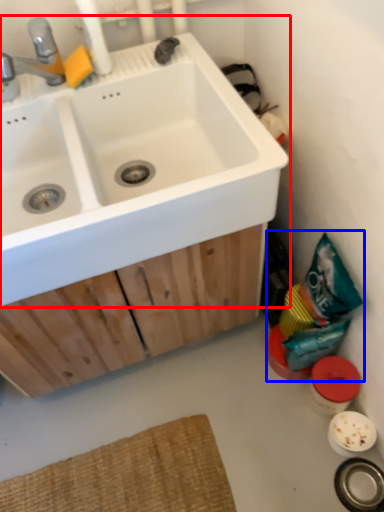
Question: Which object appears farthest to the camera in this image, sink (highlighted by a red box) or garbage (highlighted by a blue box)?

Choices:
 (A) sink
 (B) garbage

Answer: (B)